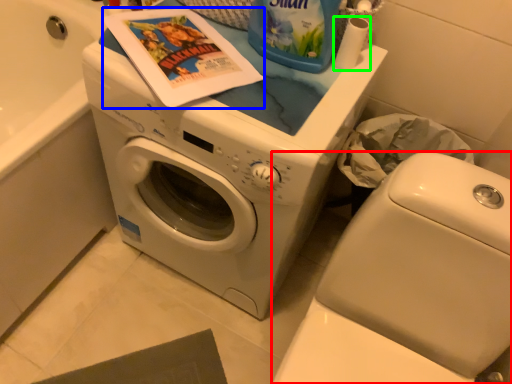
Question: Considering the real-world distances, which object is closest to washer (highlighted by a red box)? comic book (highlighted by a blue box) or toilet paper (highlighted by a green box).

Choices:
 (A) comic book
 (B) toilet paper

Answer: (B)